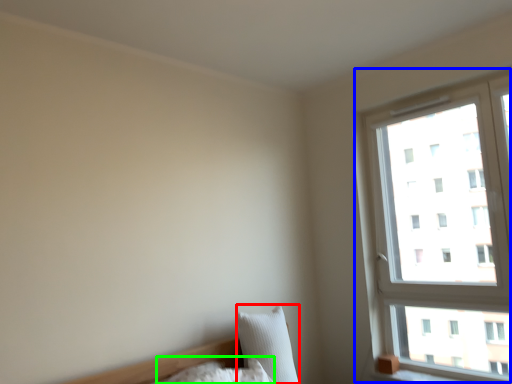
Question: Based on their relative distances, which object is farther from pillow (highlighted by a red box)? Choose from window (highlighted by a blue box) and pillow (highlighted by a green box).

Choices:
 (A) window
 (B) pillow

Answer: (A)